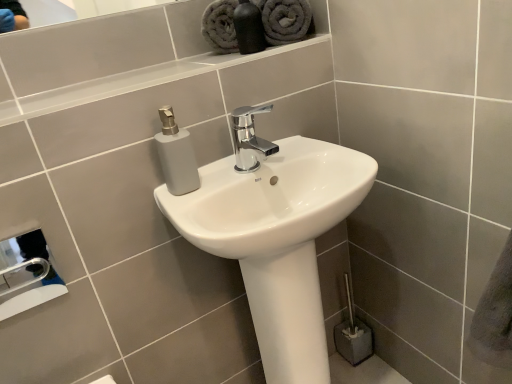
Question: Considering the relative positions of metallic silver hand dryer at lower left and gray plush towel at upper center, which is the 1th bath towel from left to right, in the image provided, is metallic silver hand dryer at lower left to the left or to the right of gray plush towel at upper center, which is the 1th bath towel from left to right,?

Choices:
 (A) left
 (B) right

Answer: (A)

Question: Is metallic silver hand dryer at lower left wider or thinner than gray plush towel at upper center, the 2th bath towel positioned from the right?

Choices:
 (A) thin
 (B) wide

Answer: (A)

Question: Which object is the farthest from the gray plush towel at upper center, which ranks as the second bath towel in left-to-right order?

Choices:
 (A) white glossy sink at center
 (B) matte black bottle at upper center
 (C) chrome metallic faucet at center
 (D) metallic silver hand dryer at lower left
 (E) gray plush towel at upper center, which is the 1th bath towel from left to right

Answer: (D)

Question: Which of these objects is positioned closest to the metallic silver hand dryer at lower left?

Choices:
 (A) gray plush towel at upper center, which ranks as the second bath towel in left-to-right order
 (B) matte black bottle at upper center
 (C) gray plush towel at upper center, which is the 1th bath towel from left to right
 (D) white glossy sink at center
 (E) chrome metallic faucet at center

Answer: (D)